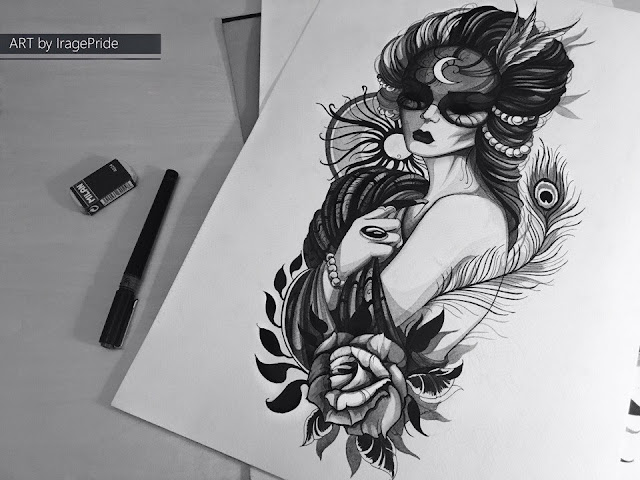
This screenshot has height=480, width=640. Identify the location of pen. (145, 255).